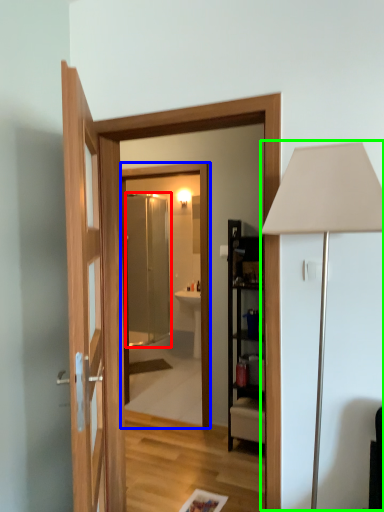
Question: Which is farther away from screen door (highlighted by a red box)? mirror (highlighted by a blue box) or table lamp (highlighted by a green box)?

Choices:
 (A) mirror
 (B) table lamp

Answer: (B)